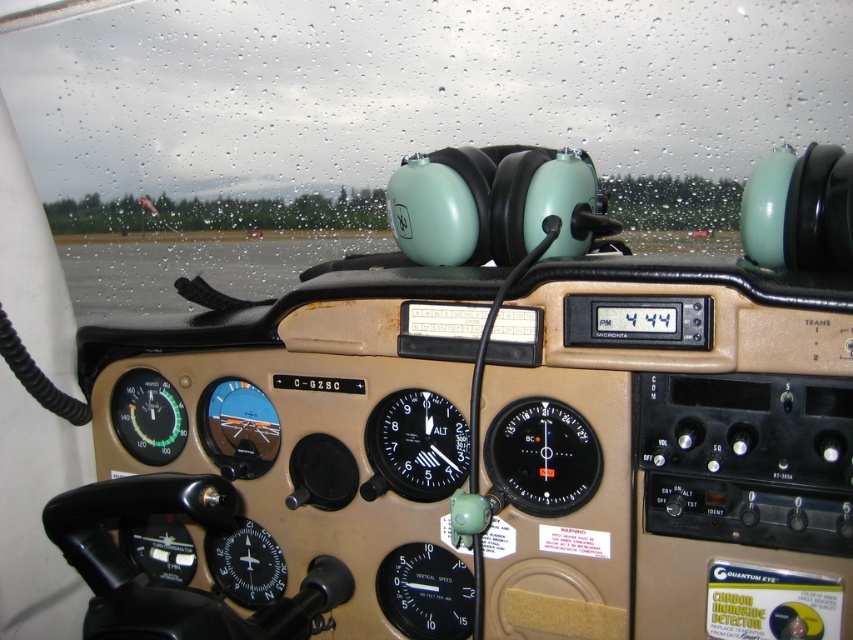
You are a pilot preparing for takeoff and need to check both the transparent glass windshield at upper center and the black plastic gauge at center. Given that your arms can reach up to 10 feet, can you comfortably reach both objects without moving your seat?

The transparent glass windshield at upper center is 9.78 feet away from the black plastic gauge at center. Since your arms can reach up to 10 feet, you can comfortably reach both objects without moving your seat.

You are a pilot checking the instrument panel in the cockpit. You notice the black plastic altimeter at center and the matte black compass at left. Which instrument is smaller in size?

The black plastic altimeter at center is smaller compared to the matte black compass at left.

You are a pilot checking the instrument panel in the cockpit. You notice two points on the panel at coordinates point (x=433, y=493) and point (x=132, y=433). Which point is nearer to your line of sight from the cockpit?

Point (x=433, y=493) is closer to the camera than point (x=132, y=433), so the point at (x=433, y=493) is nearer to your line of sight from the cockpit.